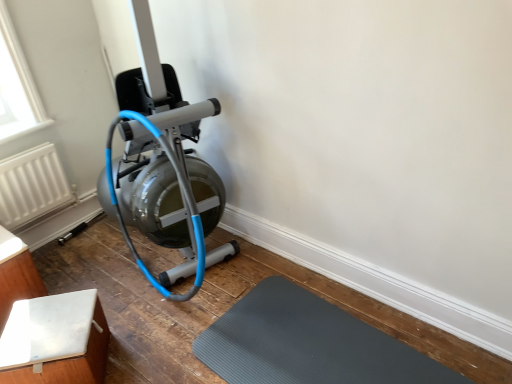
This screenshot has width=512, height=384. What are the coordinates of `vacant space that is in between gray rubber mat at lower center and matte silver stationary bicycle at left` in the screenshot? It's located at click(207, 297).